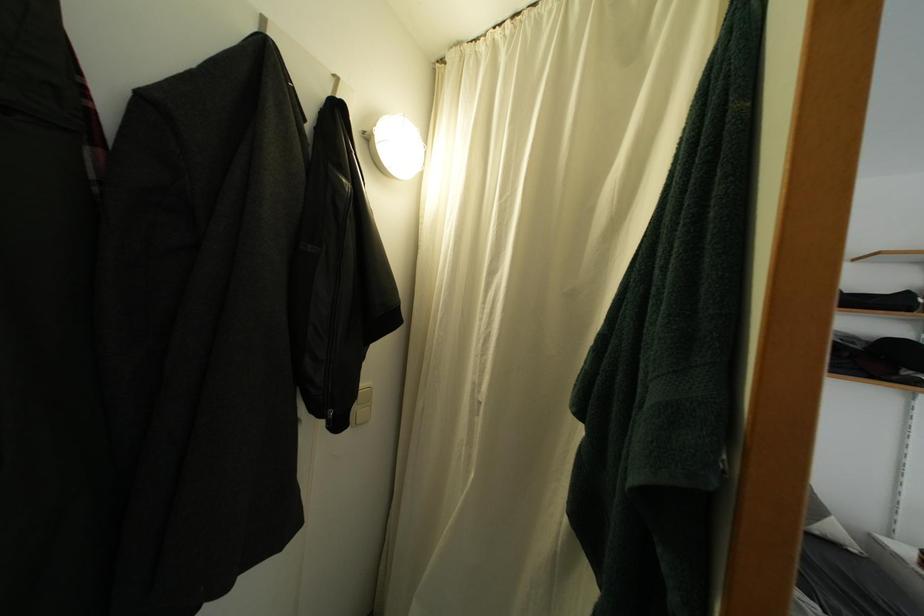
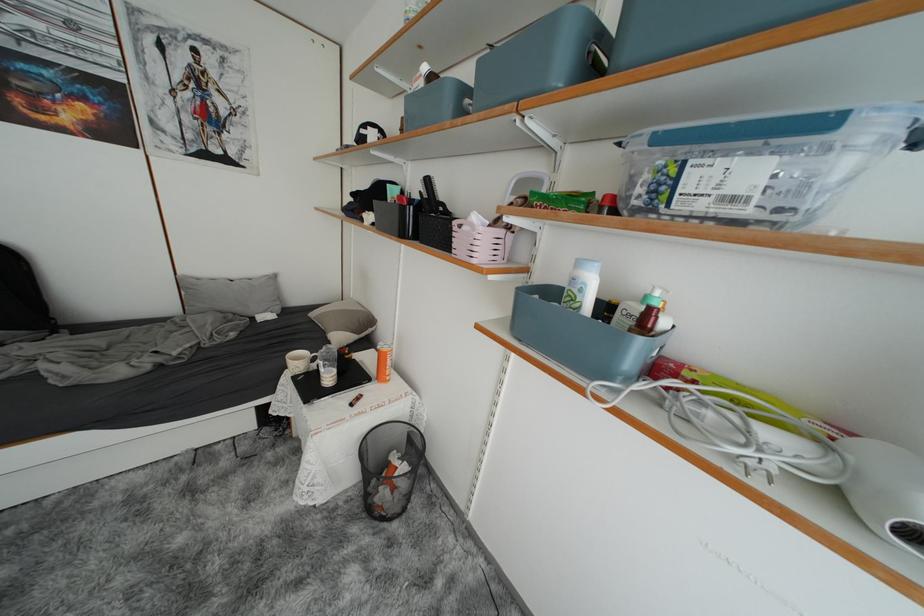
Question: The images are taken continuously from a first-person perspective. In which direction are you moving?

Choices:
 (A) Left
 (B) Right
 (C) Forward
 (D) Backward

Answer: (B)